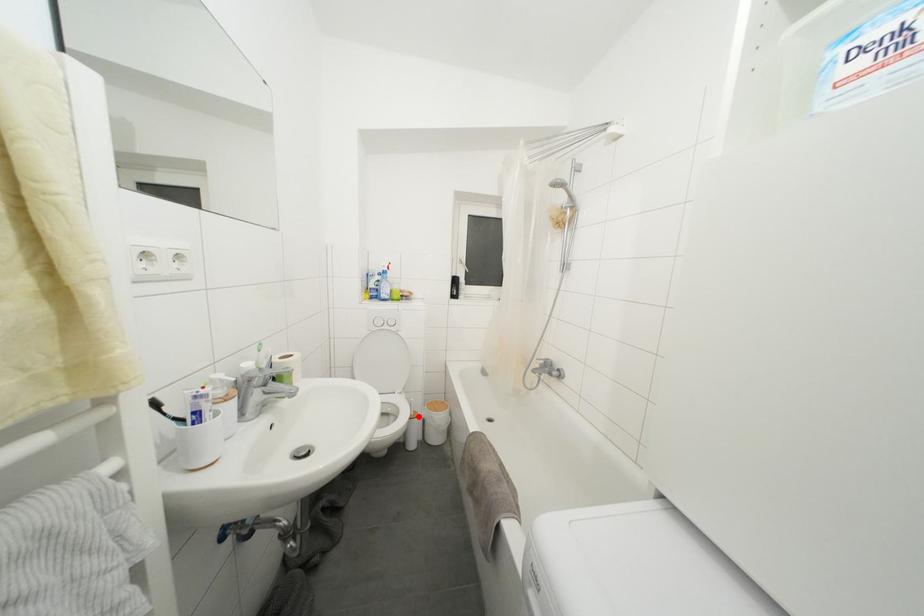
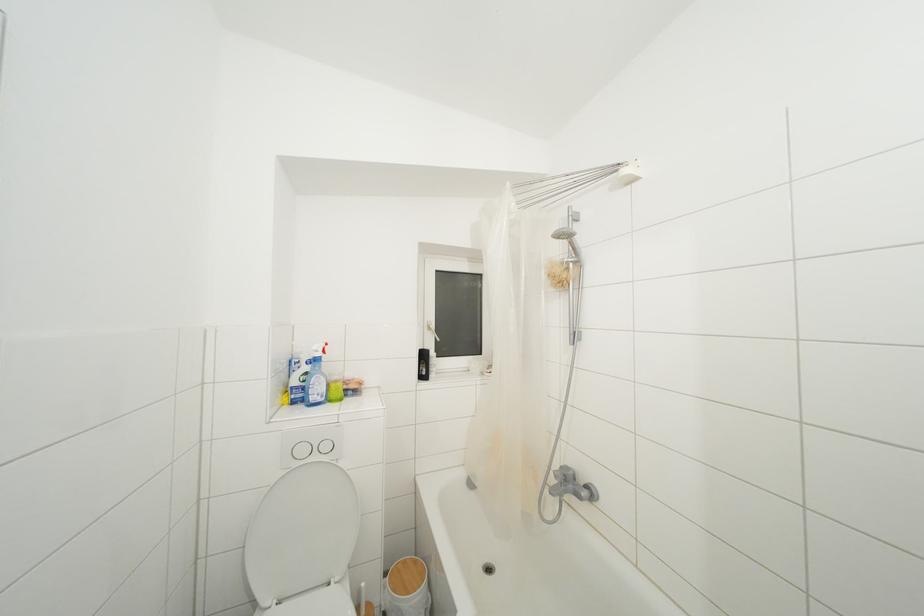
Find the pixel in the second image that matches the highlighted location in the first image.

(371, 610)